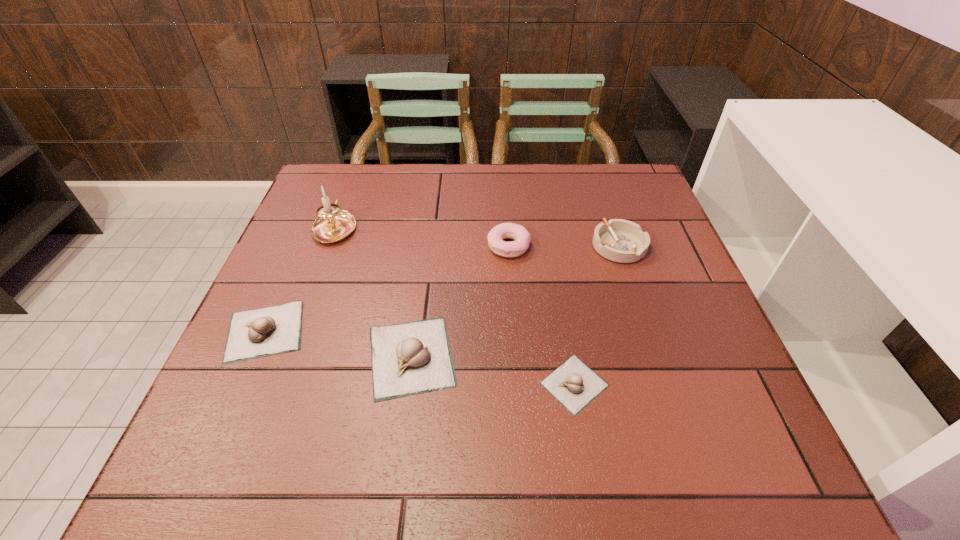
Please point a spot on the right to add another garlic. Please provide its 2D coordinates. Your answer should be formatted as a tuple, i.e. [(x, y)], where the tuple contains the x and y coordinates of a point satisfying the conditions above.

[(756, 415)]